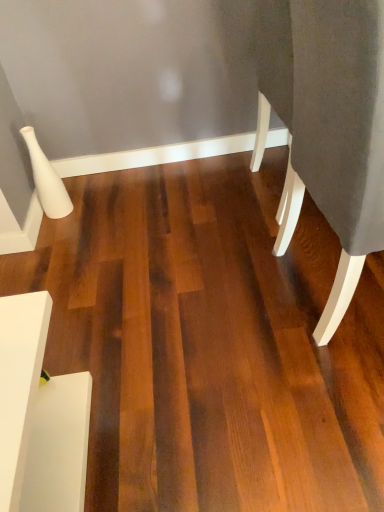
Question: Can you confirm if white matte side table at lower left, marked as the first furniture in a left-to-right arrangement, is wider than dark gray fabric at right, marked as the first furniture in a right-to-left arrangement?

Choices:
 (A) yes
 (B) no

Answer: (B)

Question: Can you see white matte side table at lower left, marked as the 1th furniture in a bottom-to-top arrangement, touching dark gray fabric at right, marked as the first furniture in a right-to-left arrangement?

Choices:
 (A) yes
 (B) no

Answer: (B)

Question: Is white matte side table at lower left, the second furniture positioned from the top, further to camera compared to dark gray fabric at right, marked as the first furniture in a right-to-left arrangement?

Choices:
 (A) no
 (B) yes

Answer: (B)

Question: From the image's perspective, is white matte side table at lower left, the second furniture positioned from the top, on dark gray fabric at right, which is the second furniture from left to right?

Choices:
 (A) no
 (B) yes

Answer: (A)

Question: Is white matte side table at lower left, the second furniture positioned from the top, turned away from dark gray fabric at right, which is the second furniture from left to right?

Choices:
 (A) yes
 (B) no

Answer: (B)

Question: Does white matte side table at lower left, marked as the 1th furniture in a bottom-to-top arrangement, appear on the right side of dark gray fabric at right, marked as the first furniture in a right-to-left arrangement?

Choices:
 (A) yes
 (B) no

Answer: (B)

Question: Considering the relative sizes of dark gray fabric at right, marked as the first furniture in a top-to-bottom arrangement, and white matte side table at lower left, marked as the first furniture in a left-to-right arrangement, in the image provided, is dark gray fabric at right, marked as the first furniture in a top-to-bottom arrangement, taller than white matte side table at lower left, marked as the first furniture in a left-to-right arrangement,?

Choices:
 (A) no
 (B) yes

Answer: (B)

Question: From the image's perspective, does dark gray fabric at right, marked as the first furniture in a top-to-bottom arrangement, appear lower than white matte side table at lower left, which is the 2th furniture in right-to-left order?

Choices:
 (A) yes
 (B) no

Answer: (B)

Question: Is dark gray fabric at right, marked as the first furniture in a right-to-left arrangement, bigger than white matte side table at lower left, marked as the first furniture in a left-to-right arrangement?

Choices:
 (A) no
 (B) yes

Answer: (B)

Question: Is dark gray fabric at right, marked as the first furniture in a top-to-bottom arrangement, further to camera compared to white matte side table at lower left, the second furniture positioned from the top?

Choices:
 (A) no
 (B) yes

Answer: (A)

Question: From a real-world perspective, is dark gray fabric at right, which is the second furniture from left to right, on white matte side table at lower left, marked as the 1th furniture in a bottom-to-top arrangement?

Choices:
 (A) no
 (B) yes

Answer: (B)

Question: Could you tell me if dark gray fabric at right, which is the second furniture from left to right, is turned towards white matte side table at lower left, the second furniture positioned from the top?

Choices:
 (A) no
 (B) yes

Answer: (A)

Question: Is point (62, 482) positioned closer to the camera than point (274, 81)?

Choices:
 (A) farther
 (B) closer

Answer: (B)